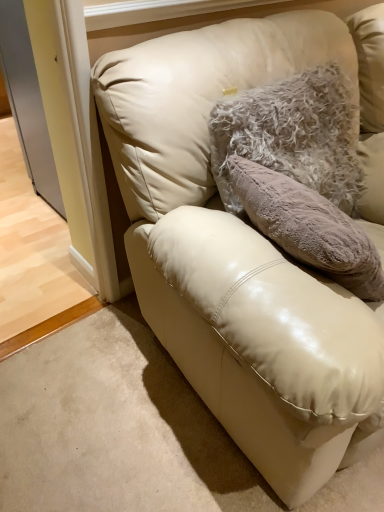
At what (x,y) coordinates should I click in order to perform the action: click on fuzzy beige pillow at upper right. Please return your answer as a coordinate pair (x, y). Looking at the image, I should click on (291, 135).

What do you see at coordinates (291, 135) in the screenshot?
I see `fuzzy beige pillow at upper right` at bounding box center [291, 135].

Identify the location of fuzzy beige pillow at upper right. (291, 135).